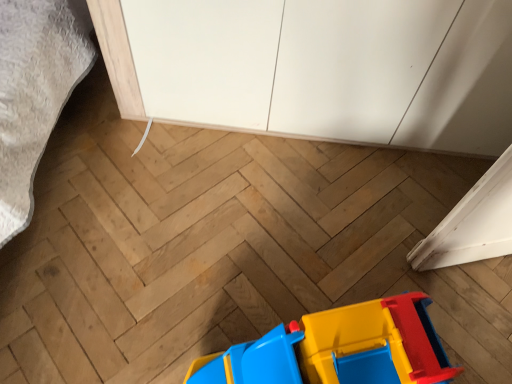
Image resolution: width=512 pixels, height=384 pixels. In order to click on vacant space situated on the left part of matte plastic toy at lower center in this screenshot , I will do `click(167, 309)`.